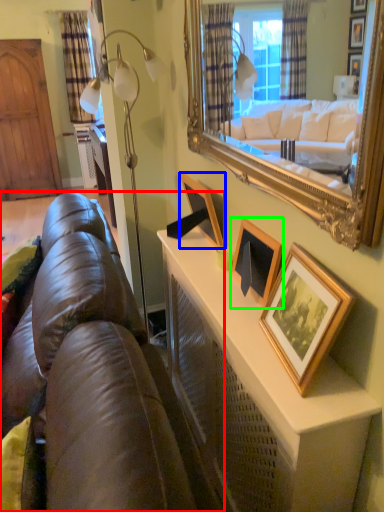
Question: Which is nearer to the studio couch (highlighted by a red box)? picture frame (highlighted by a blue box) or picture frame (highlighted by a green box).

Choices:
 (A) picture frame
 (B) picture frame

Answer: (B)